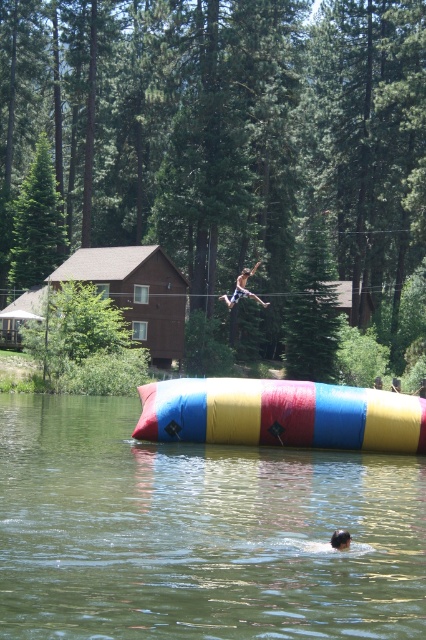
You are standing at the edge of the lake and see the point marked at coordinates (198, 532). What object is located at that point?

The point at coordinates (198, 532) corresponds to the transparent inflatable at center.